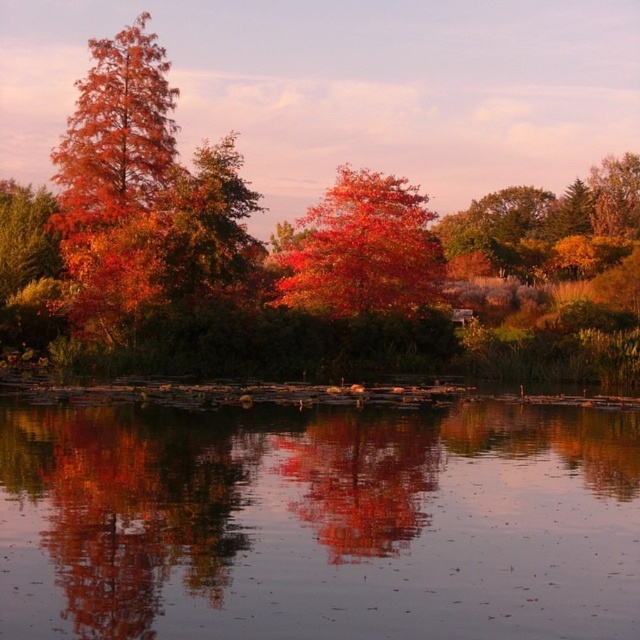
Who is more distant from viewer, (323, 198) or (339, 177)?

The point (323, 198) is behind.

Looking at this image, does autumn foliage at center have a lesser width compared to shiny red leaves at center?

No, autumn foliage at center is not thinner than shiny red leaves at center.

Image resolution: width=640 pixels, height=640 pixels. What do you see at coordinates (285, 252) in the screenshot?
I see `autumn foliage at center` at bounding box center [285, 252].

Locate an element on the screen. autumn foliage at center is located at coordinates (285, 252).

Is shiny metallic leaves at center to the left of shiny red leaves at center from the viewer's perspective?

Yes, shiny metallic leaves at center is to the left of shiny red leaves at center.

Is shiny metallic leaves at center below shiny red leaves at center?

Yes, shiny metallic leaves at center is below shiny red leaves at center.

At what (x,y) coordinates should I click in order to perform the action: click on shiny metallic leaves at center. Please return your answer as a coordinate pair (x, y). Looking at the image, I should click on (138, 516).

Is point (224, 260) positioned behind point (147, 268)?

Yes, it is.

Is autumn foliage at center smaller than shiny orange tree at left?

Incorrect, autumn foliage at center is not smaller in size than shiny orange tree at left.

Is point (196, 214) farther from camera compared to point (115, 65)?

No, (196, 214) is in front of (115, 65).

Find the location of a particular element. Image resolution: width=640 pixels, height=640 pixels. autumn foliage at center is located at coordinates (285, 252).